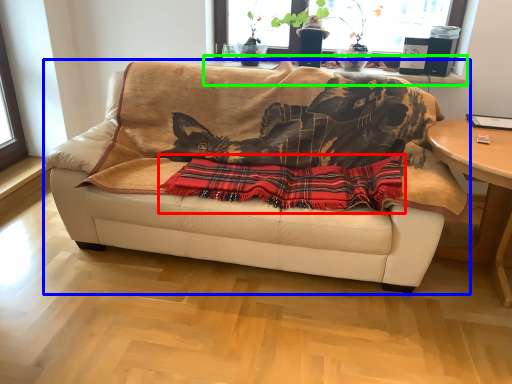
Question: Based on their relative distances, which object is nearer to plaid (highlighted by a red box)? Choose from studio couch (highlighted by a blue box) and window sill (highlighted by a green box).

Choices:
 (A) studio couch
 (B) window sill

Answer: (A)